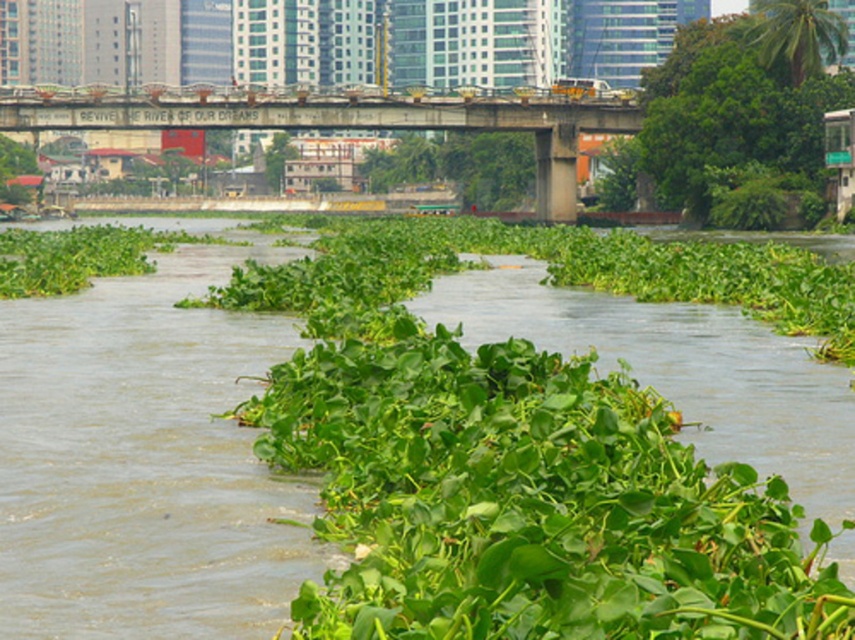
Question: Is green leafy vegetation at center closer to camera compared to concrete bridge at upper center?

Choices:
 (A) no
 (B) yes

Answer: (B)

Question: In this image, where is green leafy vegetation at center located relative to concrete bridge at upper center?

Choices:
 (A) above
 (B) below

Answer: (B)

Question: Does green leafy vegetation at center appear over green leafy plant at upper right?

Choices:
 (A) yes
 (B) no

Answer: (B)

Question: Which object is the closest to the green leafy plant at upper right?

Choices:
 (A) concrete bridge at upper center
 (B) green leafy vegetation at center

Answer: (A)

Question: Which of these objects is positioned farthest from the green leafy vegetation at center?

Choices:
 (A) concrete bridge at upper center
 (B) green leafy plant at upper right

Answer: (A)

Question: Which point is closer to the camera taking this photo?

Choices:
 (A) (669, 97)
 (B) (21, 570)

Answer: (B)